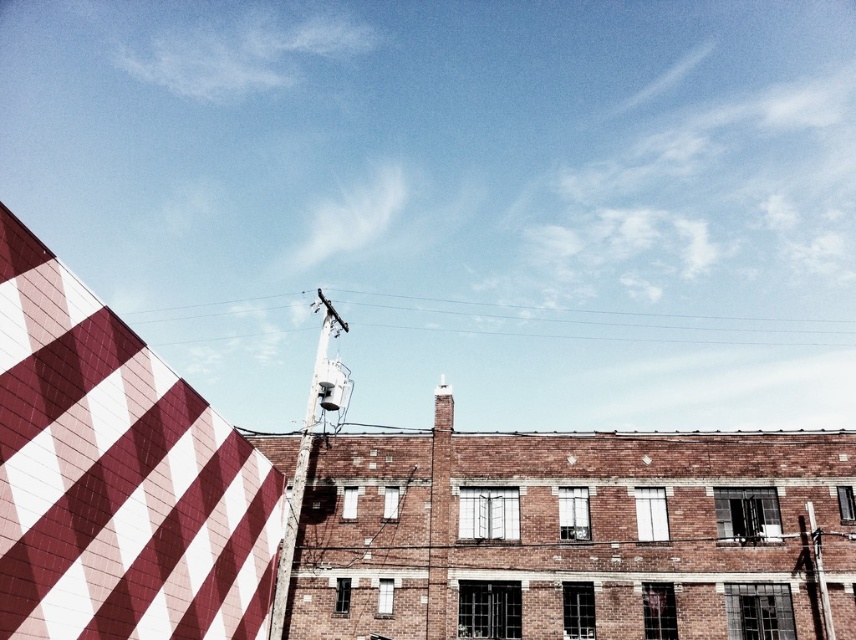
Between point (337, 321) and point (816, 566), which one is positioned behind?

The point (337, 321) is more distant.

Is point (331, 308) more distant than point (825, 589)?

Yes, point (331, 308) is farther from viewer.

Between point (275, 600) and point (828, 605), which one is positioned behind?

Point (828, 605)

The height and width of the screenshot is (640, 856). Identify the location of metallic pole at center. (307, 451).

Is diagonal striped fabric at upper left to the left of metallic pole at right from the viewer's perspective?

Indeed, diagonal striped fabric at upper left is positioned on the left side of metallic pole at right.

Can you confirm if diagonal striped fabric at upper left is smaller than metallic pole at right?

No.

The height and width of the screenshot is (640, 856). Describe the element at coordinates (116, 477) in the screenshot. I see `diagonal striped fabric at upper left` at that location.

You are a GUI agent. You are given a task and a screenshot of the screen. Output one action in this format:
    pyautogui.click(x=<x>, y=<y>)
    Task: Click on the diagonal striped fabric at upper left
    The width and height of the screenshot is (856, 640).
    Given the screenshot: What is the action you would take?
    pyautogui.click(x=116, y=477)

Can you confirm if diagonal striped fabric at upper left is shorter than metallic pole at center?

Correct, diagonal striped fabric at upper left is not as tall as metallic pole at center.

Which is below, diagonal striped fabric at upper left or metallic pole at center?

Positioned lower is diagonal striped fabric at upper left.

Is point (88, 449) positioned in front of point (334, 320)?

Yes, point (88, 449) is in front of point (334, 320).

Identify the location of diagonal striped fabric at upper left. (116, 477).